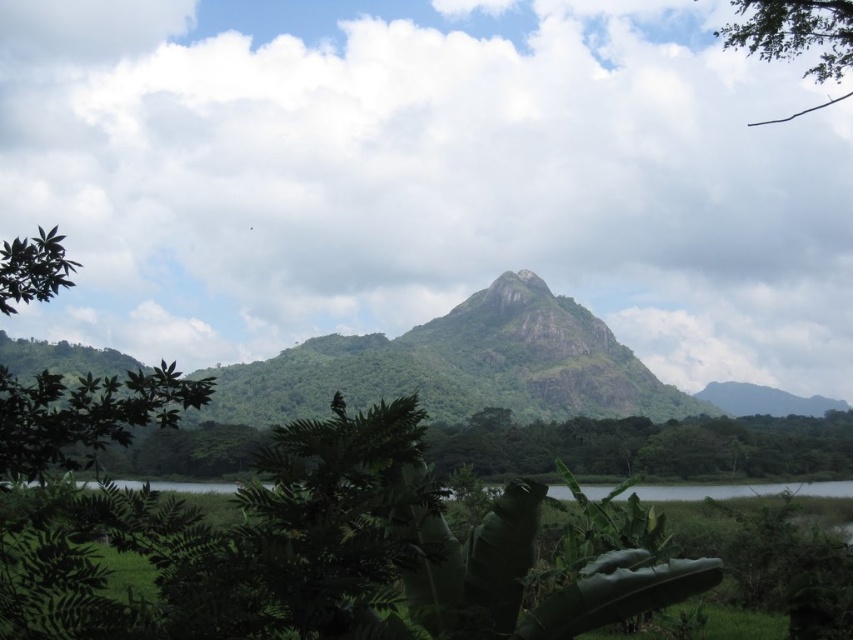
You are an environmental scientist observing the landscape. You need to determine which object has a wider spread between the green leafy tree at left and the green leafy branch at upper right. Which one do you think has a wider spread?

The green leafy branch at upper right has a wider spread than the green leafy tree at left according to the description provided.